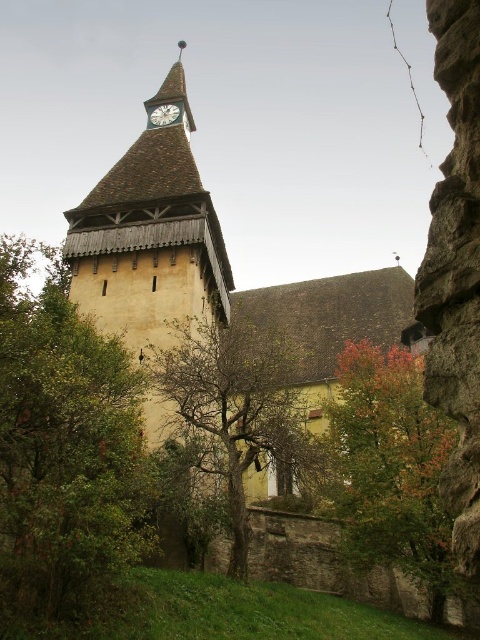
Can you confirm if yellow wooden clock tower at center is bigger than white wooden clock at upper center?

Indeed, yellow wooden clock tower at center has a larger size compared to white wooden clock at upper center.

Is yellow wooden clock tower at center thinner than white wooden clock at upper center?

Incorrect, yellow wooden clock tower at center's width is not less than white wooden clock at upper center's.

Measure the distance between yellow wooden clock tower at center and camera.

49.70 meters

Locate an element on the screen. Image resolution: width=480 pixels, height=640 pixels. yellow wooden clock tower at center is located at coordinates (207, 262).

Is green leafy tree at right in front of white wooden clock at upper center?

That is True.

Which of these two, green leafy tree at right or white wooden clock at upper center, stands shorter?

With less height is white wooden clock at upper center.

Does point (429, 422) come farther from viewer compared to point (168, 120)?

No, (429, 422) is in front of (168, 120).

The image size is (480, 640). In order to click on green leafy tree at right in this screenshot , I will do coord(392,467).

Does green leafy tree at left have a greater width compared to white wooden clock at upper center?

Correct, the width of green leafy tree at left exceeds that of white wooden clock at upper center.

Can you confirm if green leafy tree at left is positioned to the left of white wooden clock at upper center?

Yes, green leafy tree at left is to the left of white wooden clock at upper center.

Between point (37, 330) and point (163, 106), which one is positioned behind?

The point (163, 106) is more distant.

What are the coordinates of `green leafy tree at left` in the screenshot? It's located at (64, 452).